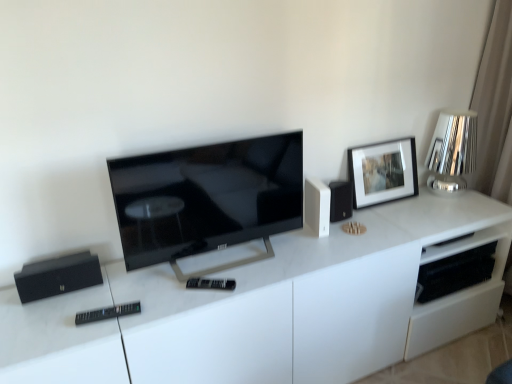
Find the location of a particular element. vacant area on top of white glossy cabinet at center (from a real-world perspective) is located at coordinates (275, 256).